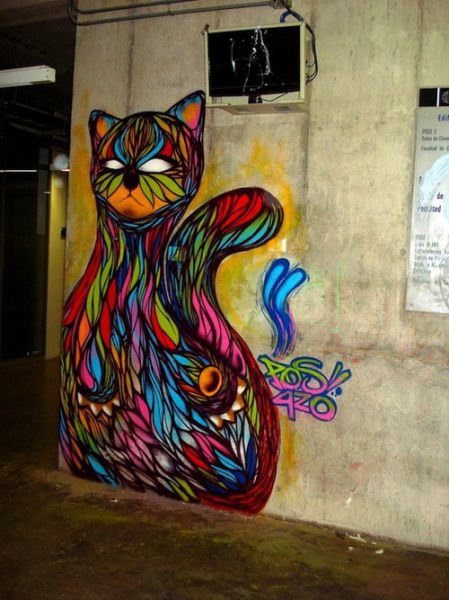
Locate an element on the screen. The width and height of the screenshot is (449, 600). screen is located at coordinates (270, 72).